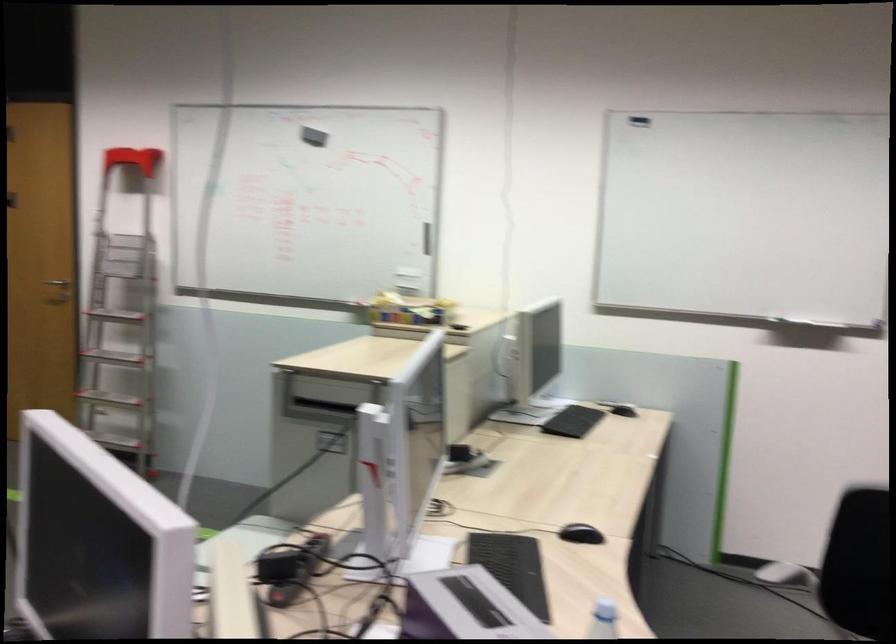
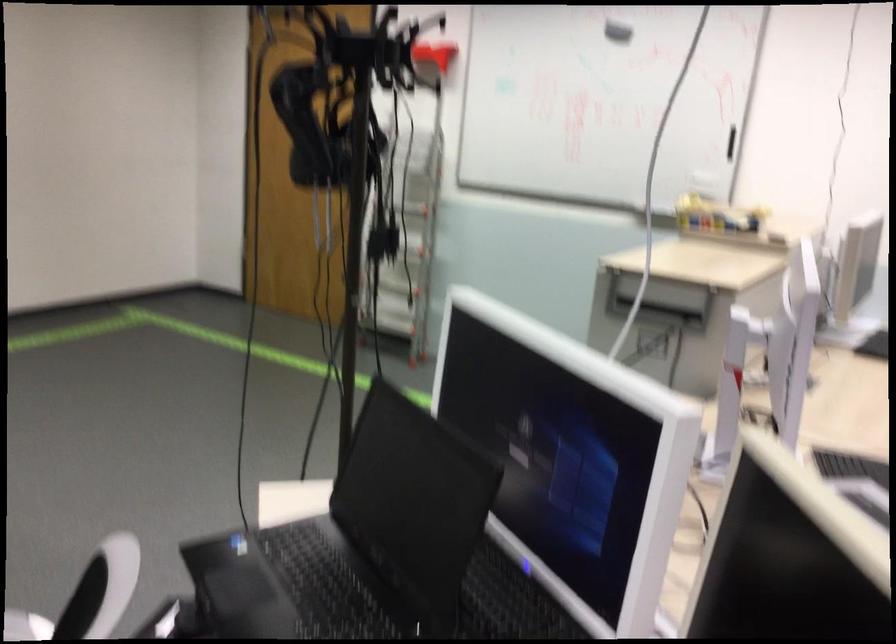
Question: I am providing you with two images of the same scene from different viewpoints. Please identify which objects are invisible in image2.

Choices:
 (A) black whiteboard eraser
 (B) black VR headset
 (C) black laptop lid
 (D) none of these

Answer: (D)